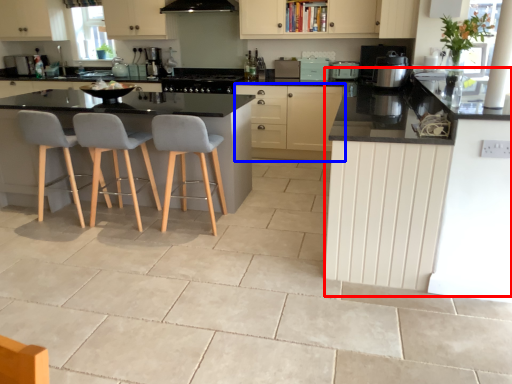
Question: Which object is further to the camera taking this photo, counter (highlighted by a red box) or cabinetry (highlighted by a blue box)?

Choices:
 (A) counter
 (B) cabinetry

Answer: (B)